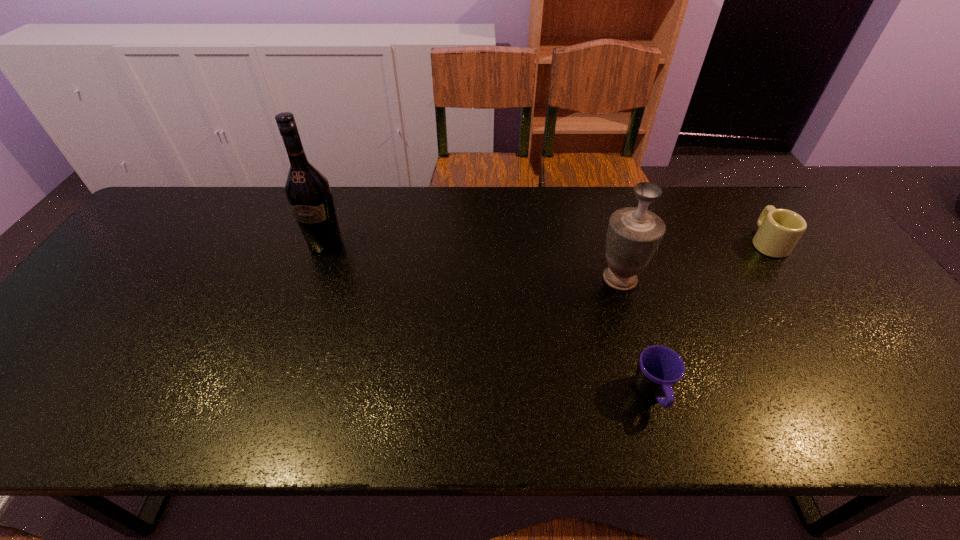
Where is `vacant area located with the handle on the side of the rightmost object`? vacant area located with the handle on the side of the rightmost object is located at coordinates (750, 216).

The height and width of the screenshot is (540, 960). What are the coordinates of `vacant space situated 0.090m with the handle on the side of the rightmost object` in the screenshot? It's located at (744, 208).

Identify the location of free space located with the handle on the side of the rightmost object. 732,190.

Find the location of `wine bottle that is at the far edge`. wine bottle that is at the far edge is located at coordinates (308, 192).

I want to click on mug that is at the far edge, so click(779, 230).

Identify the location of object that is at the near edge. The width and height of the screenshot is (960, 540). (660, 368).

Image resolution: width=960 pixels, height=540 pixels. Find the location of `object that is at the right edge`. object that is at the right edge is located at coordinates coord(779,230).

You are a GUI agent. You are given a task and a screenshot of the screen. Output one action in this format:
    pyautogui.click(x=<x>, y=<y>)
    Task: Click on the object positioned at the far right corner
    Image resolution: width=960 pixels, height=540 pixels.
    Given the screenshot: What is the action you would take?
    pyautogui.click(x=779, y=230)

Find the location of `vacant space at the far edge of the desktop`. vacant space at the far edge of the desktop is located at coordinates (721, 213).

Where is `free space at the right edge`? The height and width of the screenshot is (540, 960). free space at the right edge is located at coordinates (867, 297).